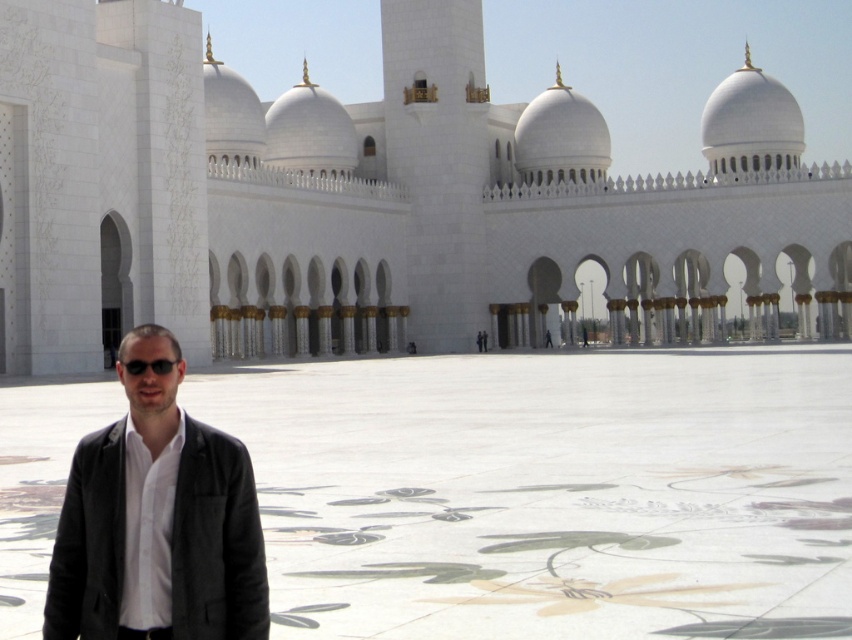
Question: Among these points, which one is nearest to the camera?

Choices:
 (A) coord(533,240)
 (B) coord(550,522)

Answer: (B)

Question: Estimate the real-world distances between objects in this image. Which object is farther from the black matte sunglasses at lower left?

Choices:
 (A) white marble courtyard at center
 (B) dark gray blazer at left

Answer: (A)

Question: Which point is farther from the camera taking this photo?

Choices:
 (A) (528, 477)
 (B) (165, 369)

Answer: (A)

Question: Does white marble mosque at center come behind dark gray blazer at left?

Choices:
 (A) yes
 (B) no

Answer: (A)

Question: Can you confirm if white marble courtyard at center is positioned to the left of dark gray blazer at left?

Choices:
 (A) no
 (B) yes

Answer: (A)

Question: Is white marble courtyard at center behind black matte sunglasses at lower left?

Choices:
 (A) yes
 (B) no

Answer: (A)